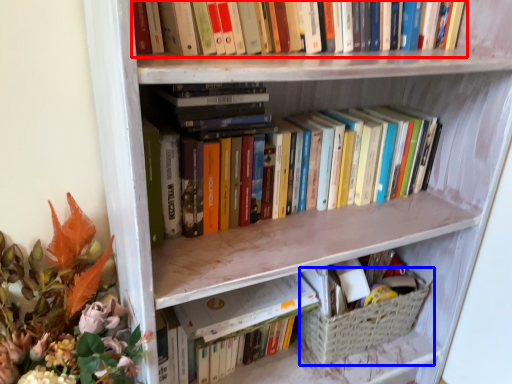
Question: Which object is further to the camera taking this photo, book (highlighted by a red box) or basket (highlighted by a blue box)?

Choices:
 (A) book
 (B) basket

Answer: (B)